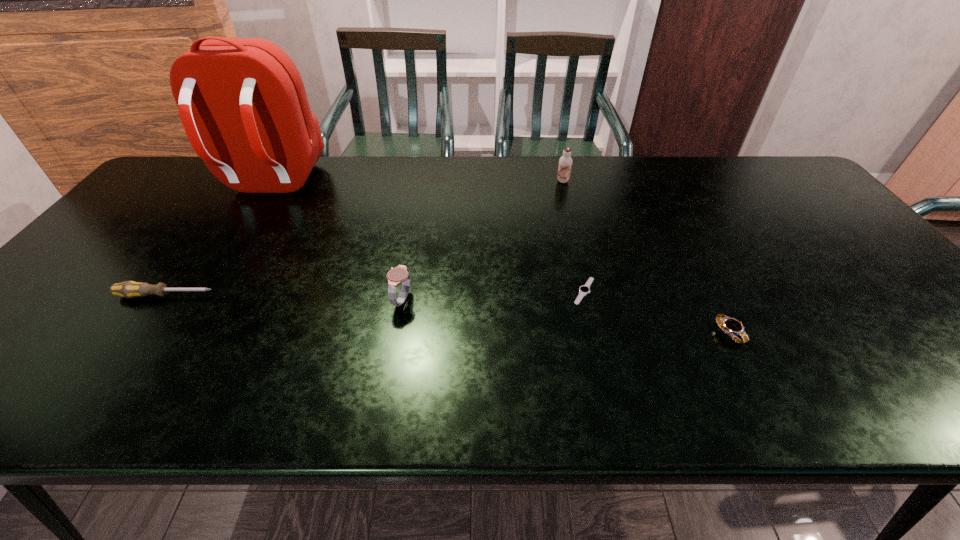
In the image, there is a desktop. Find the location of `blank space at the left edge`. blank space at the left edge is located at coordinates click(157, 207).

Where is `free region at the right edge of the desktop`? free region at the right edge of the desktop is located at coordinates (805, 214).

You are a GUI agent. You are given a task and a screenshot of the screen. Output one action in this format:
    pyautogui.click(x=<x>, y=<y>)
    Task: Click on the unoccupied area between the third object from left to right and the tallest object
    
    Given the screenshot: What is the action you would take?
    pyautogui.click(x=336, y=242)

At what (x,y) coordinates should I click in order to perform the action: click on free area in between the fifth shortest object and the third shortest object. Please return your answer as a coordinate pair (x, y). This screenshot has width=960, height=540. Looking at the image, I should click on (364, 239).

You are a GUI agent. You are given a task and a screenshot of the screen. Output one action in this format:
    pyautogui.click(x=<x>, y=<y>)
    Task: Click on the vacant area that lies between the backpack and the second watch from left to right
    Image resolution: width=960 pixels, height=540 pixels.
    Given the screenshot: What is the action you would take?
    tap(427, 238)

At what (x,y) coordinates should I click in order to perform the action: click on vacant area that lies between the backpack and the tallest watch. Please return your answer as a coordinate pair (x, y). This screenshot has width=960, height=540. Looking at the image, I should click on (336, 242).

Image resolution: width=960 pixels, height=540 pixels. Find the location of `unoccupied position between the shortest watch and the leftmost watch`. unoccupied position between the shortest watch and the leftmost watch is located at coordinates (492, 295).

Image resolution: width=960 pixels, height=540 pixels. Identify the location of free spot between the rightmost watch and the screwdriver. (447, 314).

I want to click on free space between the shortest object and the tallest watch, so click(x=492, y=295).

Identify the location of vacant space that is in between the second watch from left to right and the backpack. The width and height of the screenshot is (960, 540). (427, 238).